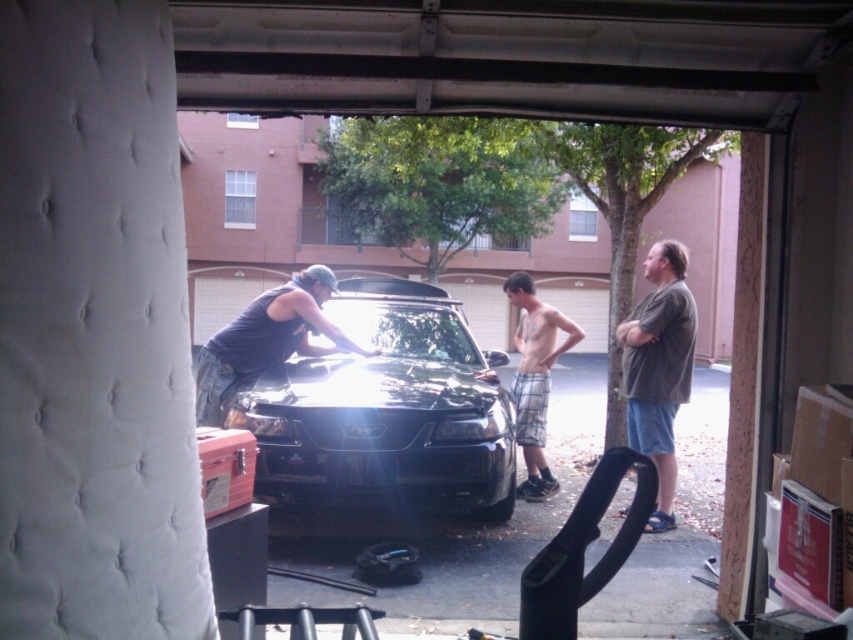
Question: Is the position of black glossy car at center more distant than that of dark gray t-shirt at right?

Choices:
 (A) no
 (B) yes

Answer: (A)

Question: Is dark gray t-shirt at right below plaid shorts at center?

Choices:
 (A) yes
 (B) no

Answer: (A)

Question: Which point is closer to the camera?

Choices:
 (A) (399, 342)
 (B) (529, 435)
 (C) (286, 346)
 (D) (675, 294)

Answer: (D)

Question: Which object is closer to the camera taking this photo?

Choices:
 (A) plaid shorts at center
 (B) black glossy car at center

Answer: (B)

Question: Which object appears farthest from the camera in this image?

Choices:
 (A) dark gray tank top at center
 (B) black glossy car at center
 (C) plaid shorts at center

Answer: (C)

Question: Is black glossy car at center below dark gray t-shirt at right?

Choices:
 (A) yes
 (B) no

Answer: (B)